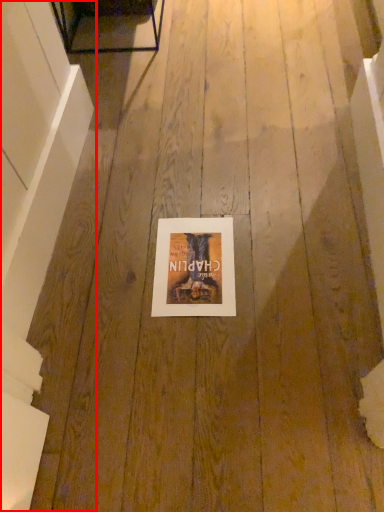
Question: From the image's perspective, what is the correct spatial positioning of stairwell (annotated by the red box) in reference to picture frame?

Choices:
 (A) above
 (B) below

Answer: (A)